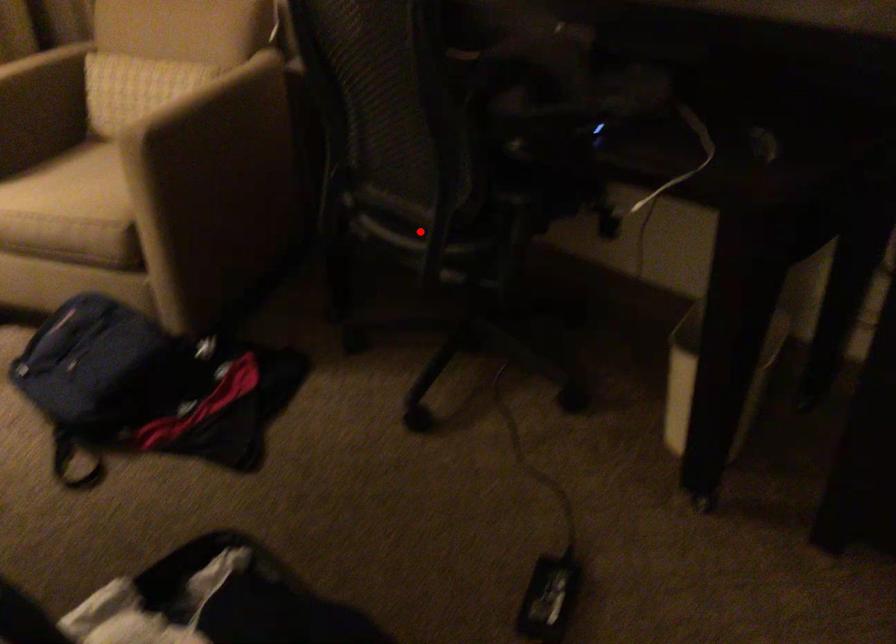
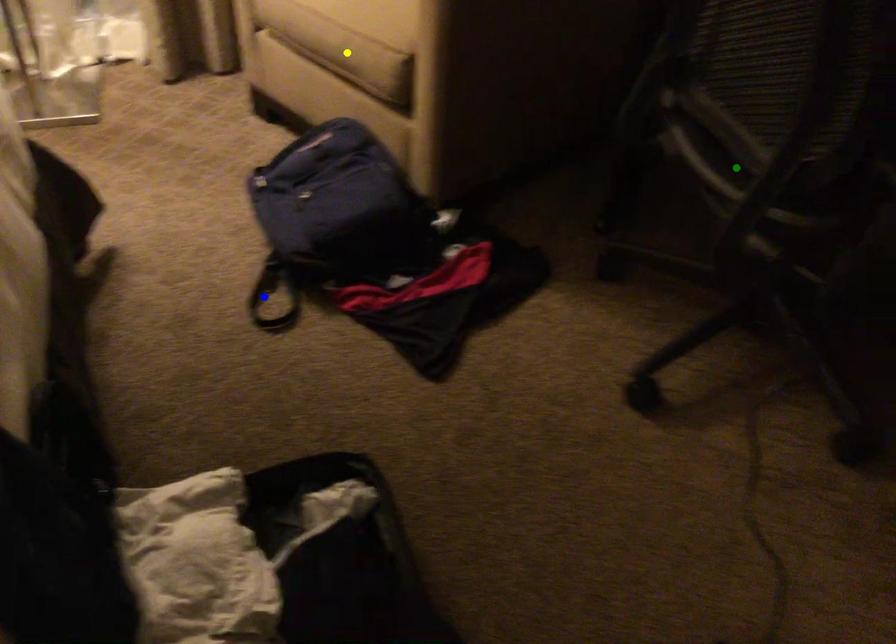
Question: I am providing you with two images of the same scene from different viewpoints. A red point is marked on the first image. You are given multiple points on the second image. Can you choose the point in image 2 that corresponds to the point in image 1?

Choices:
 (A) green point
 (B) blue point
 (C) yellow point

Answer: (A)